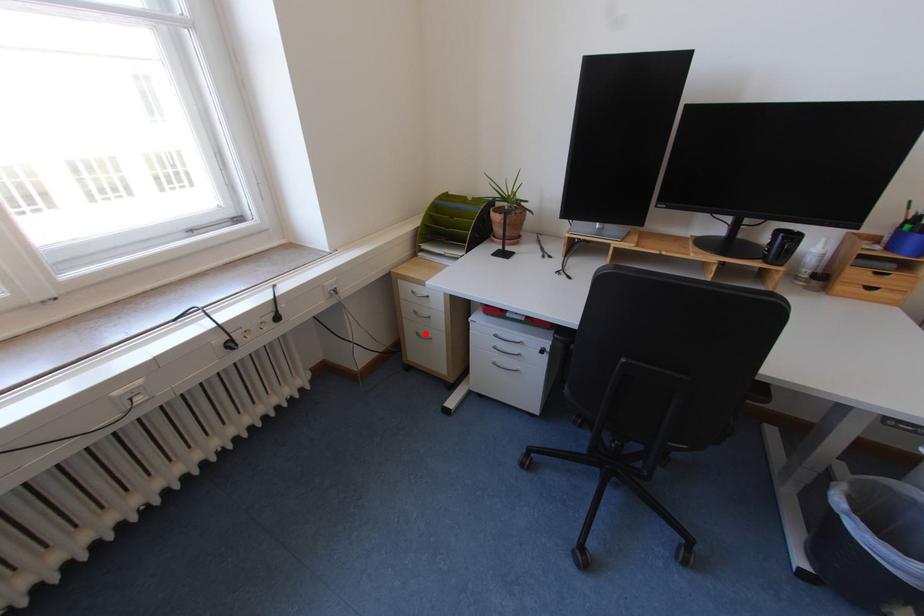
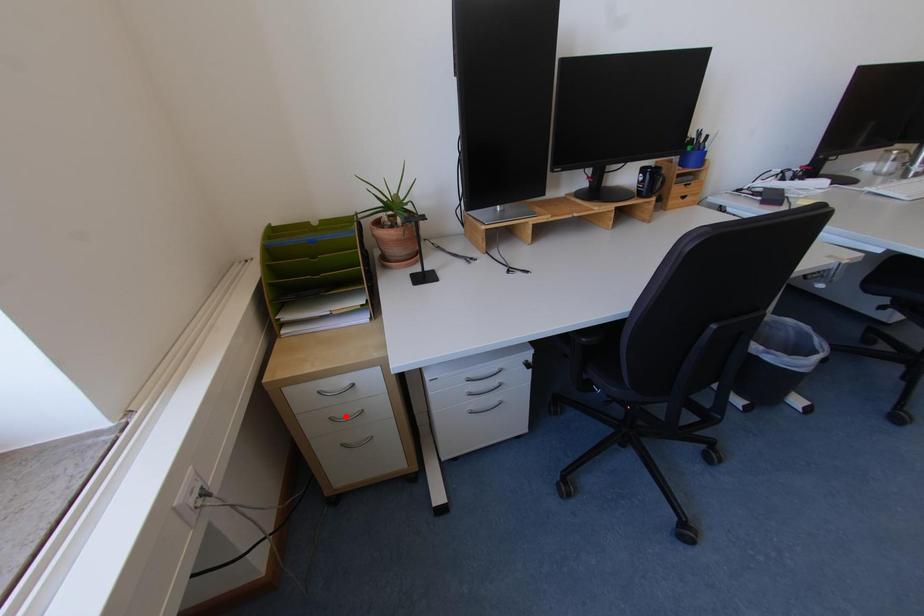
I am providing you with two images of the same scene from different viewpoints. A red point is marked on the first image and another point is marked on the second image. Does the point marked in image1 correspond to the same location as the one in image2?

No